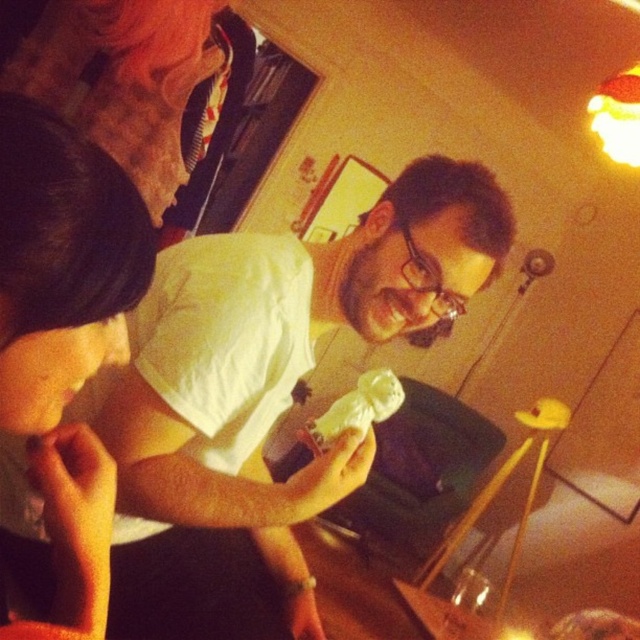
Who is positioned more to the left, matte white shirt at upper left or white fluffy cloud at center?

From the viewer's perspective, matte white shirt at upper left appears more on the left side.

Can you confirm if matte white shirt at upper left is positioned above white fluffy cloud at center?

Indeed, matte white shirt at upper left is positioned over white fluffy cloud at center.

Image resolution: width=640 pixels, height=640 pixels. What are the coordinates of `matte white shirt at upper left` in the screenshot? It's located at (64, 336).

Does white matte shirt at center have a larger size compared to white fluffy cloud at center?

Yes, white matte shirt at center is bigger than white fluffy cloud at center.

Who is lower down, white matte shirt at center or white fluffy cloud at center?

Positioned lower is white fluffy cloud at center.

Is point (124, 604) positioned before point (339, 408)?

No, it is behind (339, 408).

This screenshot has width=640, height=640. I want to click on white matte shirt at center, so click(x=264, y=396).

Does white matte shirt at center lie behind matte white shirt at upper left?

Yes, it is behind matte white shirt at upper left.

From the picture: Who is more distant from viewer, (301, 496) or (96, 356)?

Positioned behind is point (301, 496).

At what (x,y) coordinates should I click in order to perform the action: click on white matte shirt at center. Please return your answer as a coordinate pair (x, y). This screenshot has height=640, width=640. Looking at the image, I should click on (264, 396).